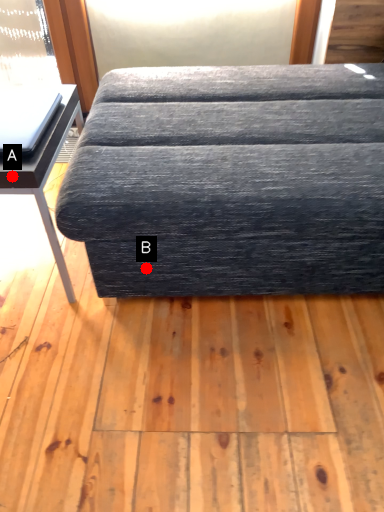
Question: Two points are circled on the image, labeled by A and B beside each circle. Which point is farther to the camera?

Choices:
 (A) A is further
 (B) B is further

Answer: (B)